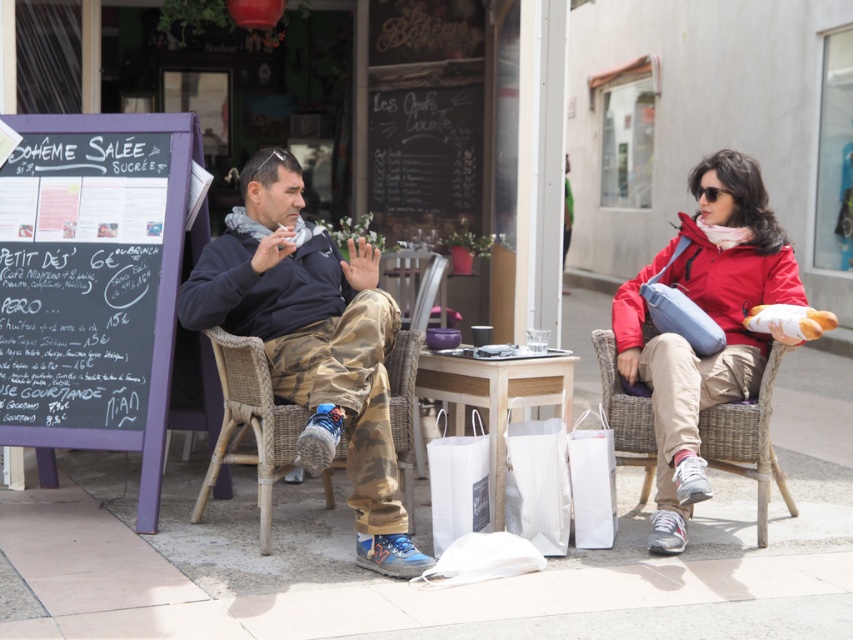
Between camouflage pants at center and white paper bag at lower center, which one is positioned lower?

white paper bag at lower center is lower down.

Who is higher up, camouflage pants at center or white paper bag at lower center?

Positioned higher is camouflage pants at center.

Between point (363, 346) and point (572, 451), which one is positioned in front?

Positioned in front is point (363, 346).

Where is `camouflage pants at center`? camouflage pants at center is located at coordinates (305, 323).

Which is more to the left, camo pants at center or white paper bag at center?

From the viewer's perspective, camo pants at center appears more on the left side.

Describe the element at coordinates (312, 340) in the screenshot. The image size is (853, 640). I see `camo pants at center` at that location.

I want to click on camo pants at center, so click(312, 340).

I want to click on camo pants at center, so click(x=312, y=340).

Is camouflage pants at center further to the viewer compared to woven wicker chair at right?

No, camouflage pants at center is closer to the viewer.

In order to click on camouflage pants at center in this screenshot , I will do `click(305, 323)`.

This screenshot has height=640, width=853. In order to click on camouflage pants at center in this screenshot , I will do `click(305, 323)`.

Identify the location of camouflage pants at center. Image resolution: width=853 pixels, height=640 pixels. (305, 323).